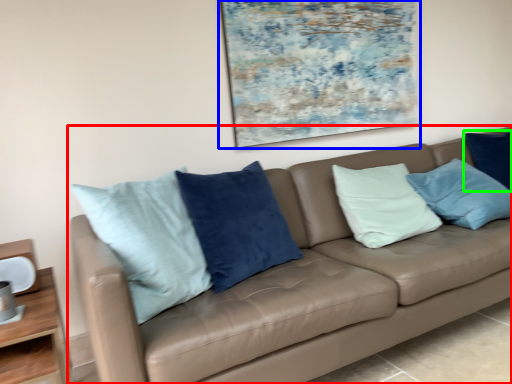
Question: Based on their relative distances, which object is nearer to studio couch (highlighted by a red box)? Choose from picture frame (highlighted by a blue box) and pillow (highlighted by a green box).

Choices:
 (A) picture frame
 (B) pillow

Answer: (A)